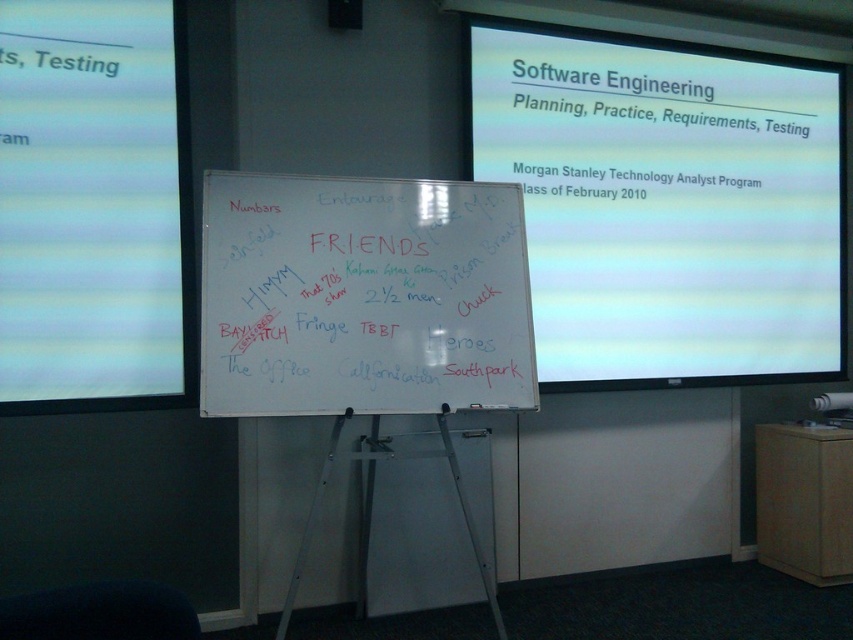
You are a student in the classroom and need to present your slide on the white glossy projector screen at upper center and the white matte projection screen at upper left. Which screen should you aim your projector at to ensure it reaches the correct side of the room?

The white glossy projector screen at upper center is positioned on the right side of the white matte projection screen at upper left, so you should aim your projector at the white glossy projector screen at upper center to reach the right side of the room.

You are a student in the classroom and need to write a note on the whiteboard. Where is the whiteboard located relative to the white matte projection screen at upper left?

The whiteboard is in the foreground, while the white matte projection screen at upper left is in the background. Since the whiteboard is in the foreground, it is closer to you than the white matte projection screen at upper left.